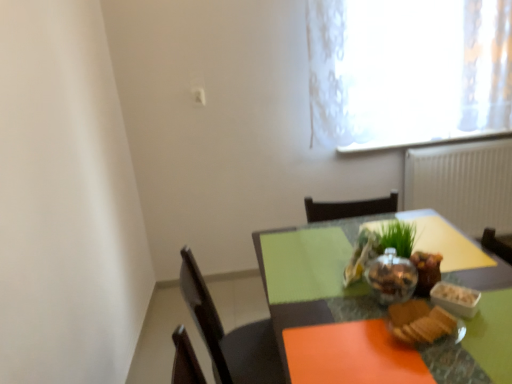
I want to click on vacant space positioned to the left of shiny metallic bowl at center, the second food from the front, so click(x=334, y=310).